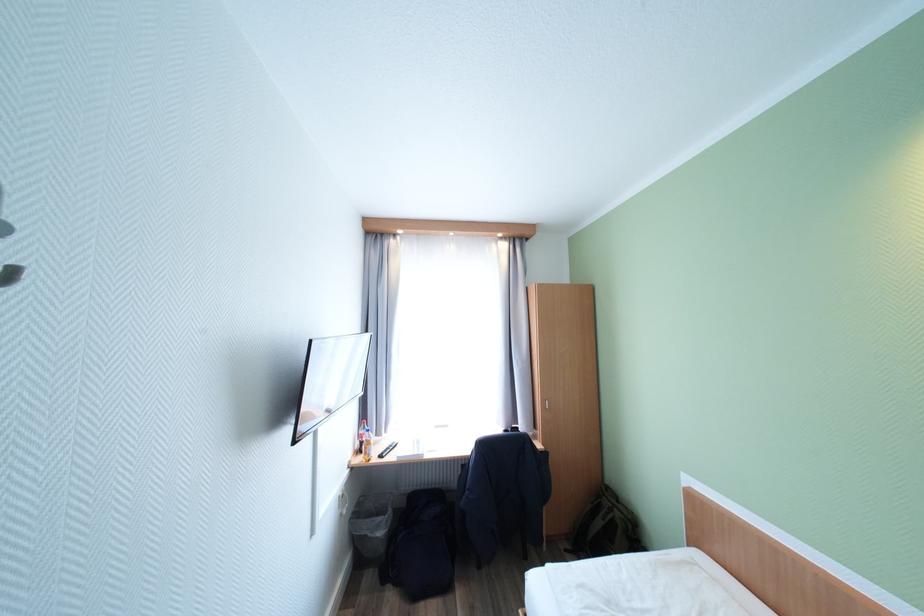
Find where to lift the gray trash can. Please return your answer as a coordinate pair (x, y).

(371, 523)